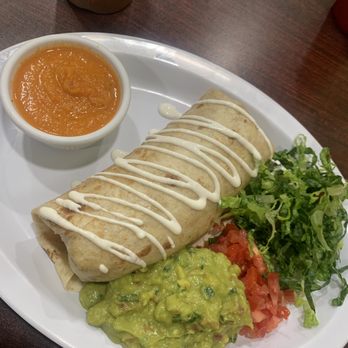
Identify the location of white plate. (145, 102).